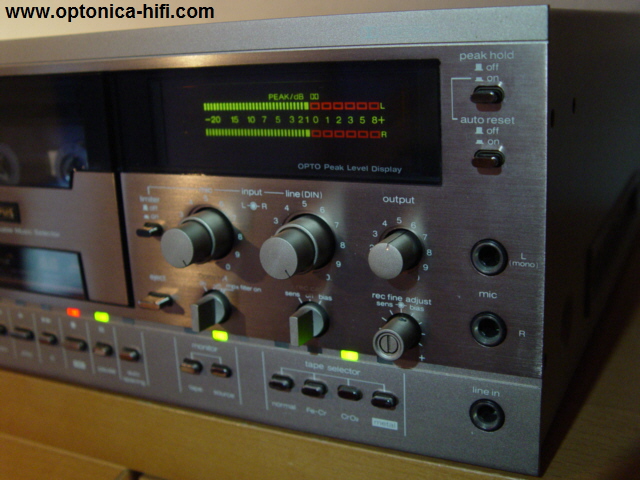
I want to click on cassette player, so click(43, 173).